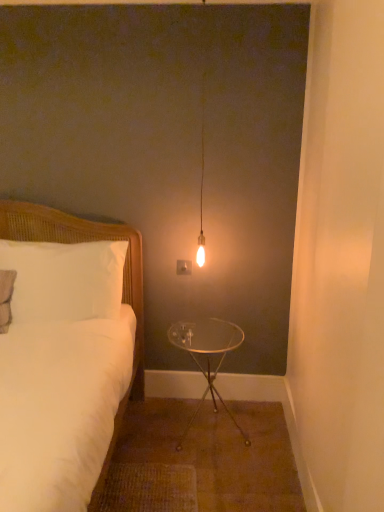
Question: From the image's perspective, is clear glass table at center on top of white woven bed at left?

Choices:
 (A) no
 (B) yes

Answer: (A)

Question: From a real-world perspective, is clear glass table at center under white woven bed at left?

Choices:
 (A) yes
 (B) no

Answer: (A)

Question: Is clear glass table at center shorter than white woven bed at left?

Choices:
 (A) no
 (B) yes

Answer: (B)

Question: Does clear glass table at center appear on the right side of white woven bed at left?

Choices:
 (A) yes
 (B) no

Answer: (A)

Question: Can you confirm if clear glass table at center is bigger than white woven bed at left?

Choices:
 (A) yes
 (B) no

Answer: (B)

Question: Is clear glass table at center positioned with its back to white woven bed at left?

Choices:
 (A) yes
 (B) no

Answer: (B)

Question: Is matte glass bulb at center at the back of white woven bed at left?

Choices:
 (A) no
 (B) yes

Answer: (A)

Question: Is matte glass bulb at center inside white woven bed at left?

Choices:
 (A) no
 (B) yes

Answer: (A)

Question: Is white woven bed at left completely or partially outside of matte glass bulb at center?

Choices:
 (A) no
 (B) yes

Answer: (B)

Question: Is white woven bed at left smaller than matte glass bulb at center?

Choices:
 (A) no
 (B) yes

Answer: (A)

Question: Is white woven bed at left at the left side of matte glass bulb at center?

Choices:
 (A) yes
 (B) no

Answer: (A)

Question: From a real-world perspective, is white woven bed at left positioned under matte glass bulb at center based on gravity?

Choices:
 (A) no
 (B) yes

Answer: (B)

Question: Is white woven bed at left at the right side of white wicker pillow at left?

Choices:
 (A) no
 (B) yes

Answer: (A)